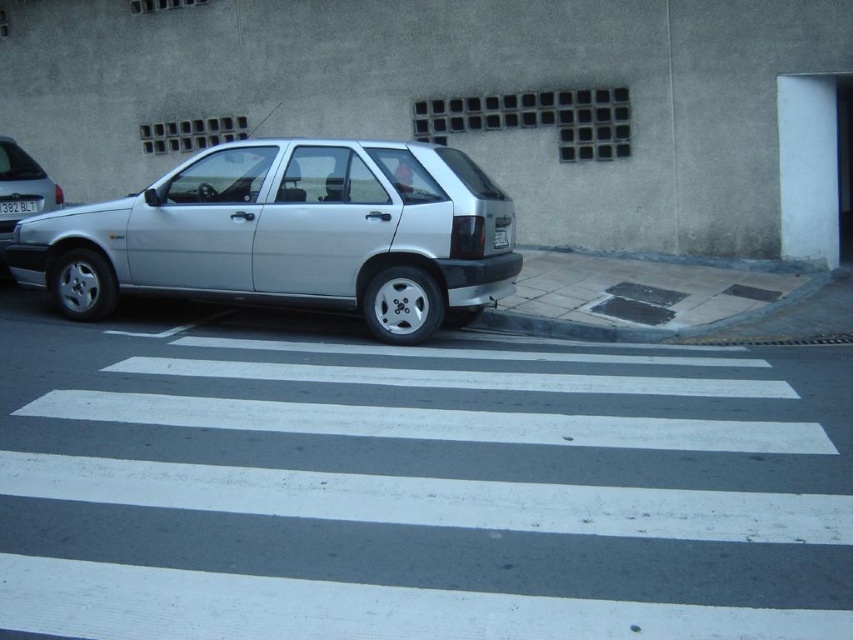
Which is below, satin silver car at center or silver metallic hatchback at left?

satin silver car at center is below.

Locate an element on the screen. This screenshot has width=853, height=640. satin silver car at center is located at coordinates (289, 234).

Is point (440, 204) positioned in front of point (45, 209)?

Yes, it is in front of point (45, 209).

Identify the location of satin silver car at center. 289,234.

Does satin silver car at center have a lesser width compared to white plastic license plate at center?

No, satin silver car at center is not thinner than white plastic license plate at center.

Between satin silver car at center and white plastic license plate at center, which one is positioned higher?

Positioned higher is white plastic license plate at center.

Is point (227, 218) closer to viewer compared to point (21, 209)?

Yes, point (227, 218) is closer to viewer.

Identify the location of satin silver car at center. Image resolution: width=853 pixels, height=640 pixels. (289, 234).

Consider the image. Who is lower down, silver metallic hatchback at left or white plastic license plate at center?

Positioned lower is white plastic license plate at center.

Does silver metallic hatchback at left appear on the right side of white plastic license plate at center?

No, silver metallic hatchback at left is not to the right of white plastic license plate at center.

The image size is (853, 640). What do you see at coordinates (22, 186) in the screenshot?
I see `silver metallic hatchback at left` at bounding box center [22, 186].

Where is `silver metallic hatchback at left`? silver metallic hatchback at left is located at coordinates (22, 186).